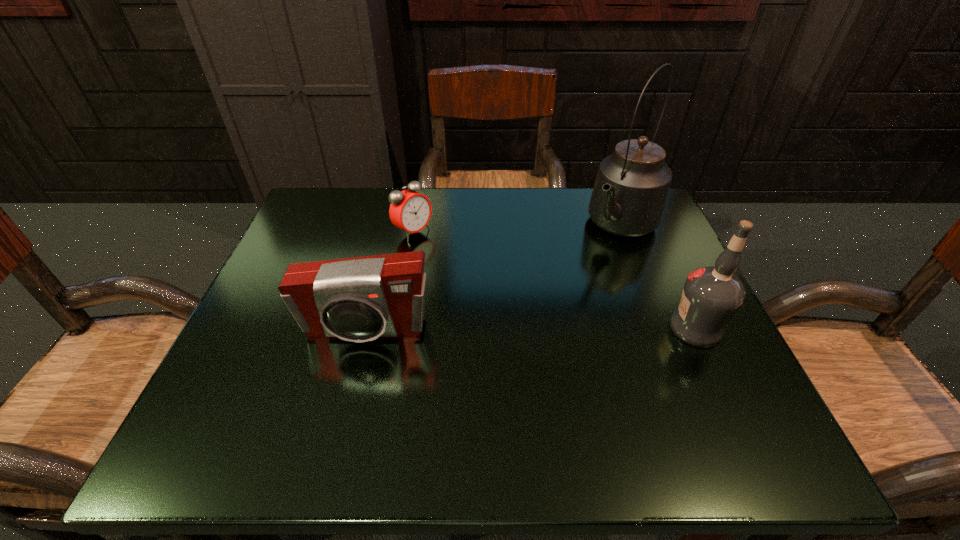
Where is `unoccupied area between the third shortest object and the tallest object`? This screenshot has width=960, height=540. unoccupied area between the third shortest object and the tallest object is located at coordinates (659, 277).

Where is `free spot between the second shortest object and the tallest object`? This screenshot has width=960, height=540. free spot between the second shortest object and the tallest object is located at coordinates (492, 279).

What are the coordinates of `object that is the second nearest to the third tallest object` in the screenshot? It's located at (628, 199).

At what (x,y) coordinates should I click in order to perform the action: click on the third closest object relative to the second tallest object. Please return your answer as a coordinate pair (x, y). Image resolution: width=960 pixels, height=540 pixels. Looking at the image, I should click on (410, 211).

The height and width of the screenshot is (540, 960). What are the coordinates of `free spot that satisfies the following two spatial constraints: 1. on the front side of the second tallest object; 2. on the front label of the shortest object` in the screenshot? It's located at pyautogui.click(x=396, y=328).

You are a GUI agent. You are given a task and a screenshot of the screen. Output one action in this format:
    pyautogui.click(x=<x>, y=<y>)
    Task: Click on the vacant space that satisfies the following two spatial constraints: 1. on the front side of the kettle; 2. on the front label of the third shortest object
    
    Given the screenshot: What is the action you would take?
    pyautogui.click(x=660, y=328)